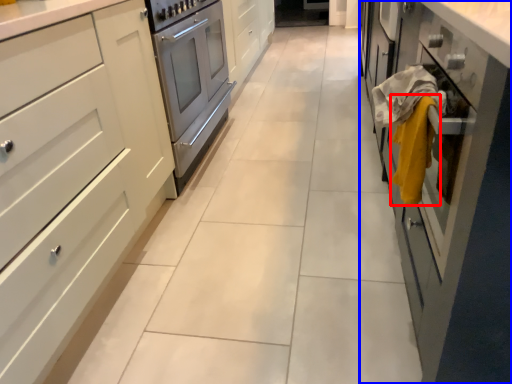
Question: Which object is further to the camera taking this photo, blanket (highlighted by a red box) or cabinetry (highlighted by a blue box)?

Choices:
 (A) blanket
 (B) cabinetry

Answer: (A)